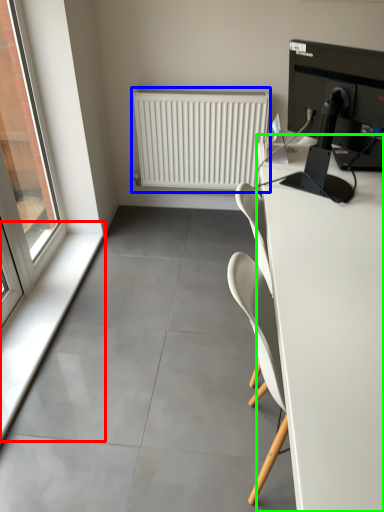
Question: Considering the real-world distances, which object is closest to window sill (highlighted by a red box)? radiator (highlighted by a blue box) or desk (highlighted by a green box).

Choices:
 (A) radiator
 (B) desk

Answer: (A)